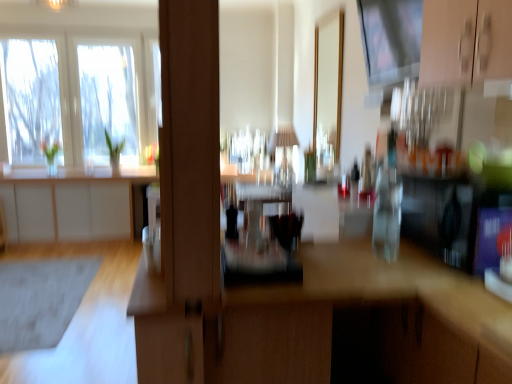
Question: From the image's perspective, does wooden desk at center appear higher than clear glass window at upper left?

Choices:
 (A) no
 (B) yes

Answer: (A)

Question: From the image's perspective, is wooden desk at center located beneath clear glass window at upper left?

Choices:
 (A) no
 (B) yes

Answer: (B)

Question: Considering the relative sizes of wooden desk at center and clear glass window at upper left in the image provided, is wooden desk at center shorter than clear glass window at upper left?

Choices:
 (A) no
 (B) yes

Answer: (B)

Question: Is wooden desk at center looking in the opposite direction of clear glass window at upper left?

Choices:
 (A) no
 (B) yes

Answer: (A)

Question: Does wooden desk at center have a larger size compared to clear glass window at upper left?

Choices:
 (A) no
 (B) yes

Answer: (B)

Question: Is wooden desk at center not within clear glass window at upper left?

Choices:
 (A) no
 (B) yes

Answer: (B)

Question: From a real-world perspective, is transparent glass window screen at upper center below gray matte rug at lower left?

Choices:
 (A) no
 (B) yes

Answer: (A)

Question: Is transparent glass window screen at upper center to the right of gray matte rug at lower left from the viewer's perspective?

Choices:
 (A) yes
 (B) no

Answer: (A)

Question: Does transparent glass window screen at upper center have a smaller size compared to gray matte rug at lower left?

Choices:
 (A) no
 (B) yes

Answer: (A)

Question: Considering the relative positions of transparent glass window screen at upper center and gray matte rug at lower left in the image provided, is transparent glass window screen at upper center to the left of gray matte rug at lower left from the viewer's perspective?

Choices:
 (A) no
 (B) yes

Answer: (A)

Question: From a real-world perspective, is transparent glass window screen at upper center on gray matte rug at lower left?

Choices:
 (A) yes
 (B) no

Answer: (A)

Question: Is transparent glass window screen at upper center with gray matte rug at lower left?

Choices:
 (A) yes
 (B) no

Answer: (B)

Question: Considering the relative sizes of gray matte rug at lower left and white matte cabinet at left in the image provided, is gray matte rug at lower left taller than white matte cabinet at left?

Choices:
 (A) yes
 (B) no

Answer: (B)